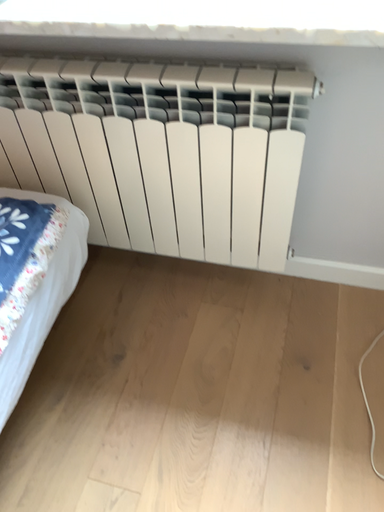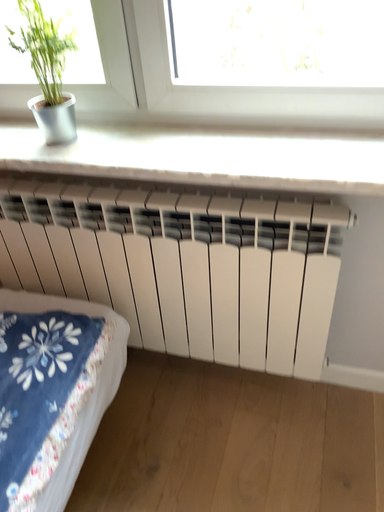
Question: Which way did the camera rotate in the video?

Choices:
 (A) rotated downward
 (B) rotated upward

Answer: (B)